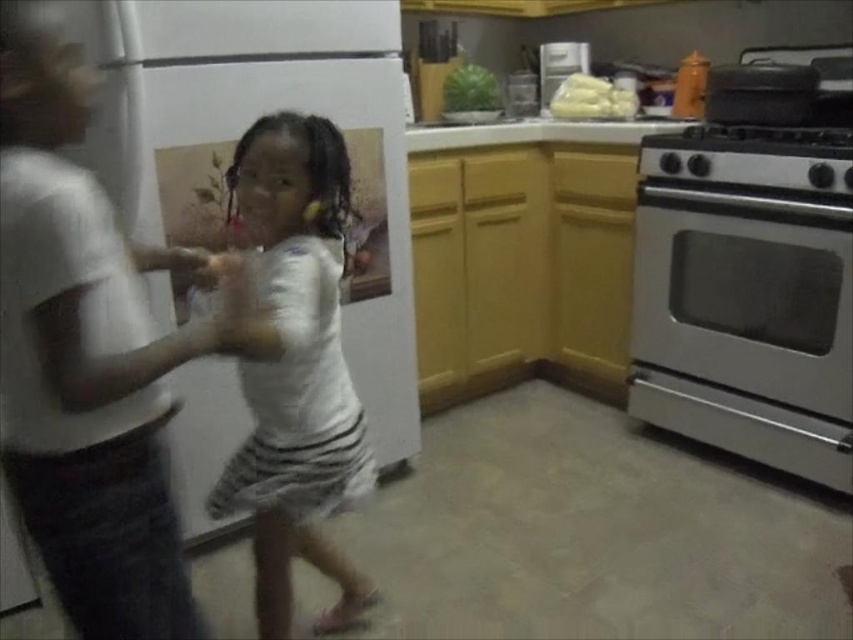
Is stainless steel stove at right thinner than clear glass jar at upper center?

In fact, stainless steel stove at right might be wider than clear glass jar at upper center.

The height and width of the screenshot is (640, 853). What do you see at coordinates (752, 156) in the screenshot?
I see `stainless steel stove at right` at bounding box center [752, 156].

Where is `stainless steel stove at right`? stainless steel stove at right is located at coordinates (752, 156).

Does white matte shirt at left have a greater height compared to stainless steel oven at right?

In fact, white matte shirt at left may be shorter than stainless steel oven at right.

You are a GUI agent. You are given a task and a screenshot of the screen. Output one action in this format:
    pyautogui.click(x=<x>, y=<y>)
    Task: Click on the white matte shirt at left
    
    Given the screenshot: What is the action you would take?
    pyautogui.click(x=85, y=362)

Who is more distant from viewer, (54, 358) or (830, 342)?

The point (830, 342) is more distant.

The image size is (853, 640). Identify the location of white matte shirt at left. (85, 362).

Does stainless steel oven at right have a greater height compared to stainless steel stove at right?

Yes.

Is stainless steel oven at right to the left of stainless steel stove at right from the viewer's perspective?

Correct, you'll find stainless steel oven at right to the left of stainless steel stove at right.

Does point (648, 307) come in front of point (640, 160)?

No, (648, 307) is further to viewer.

This screenshot has height=640, width=853. I want to click on stainless steel oven at right, so click(744, 324).